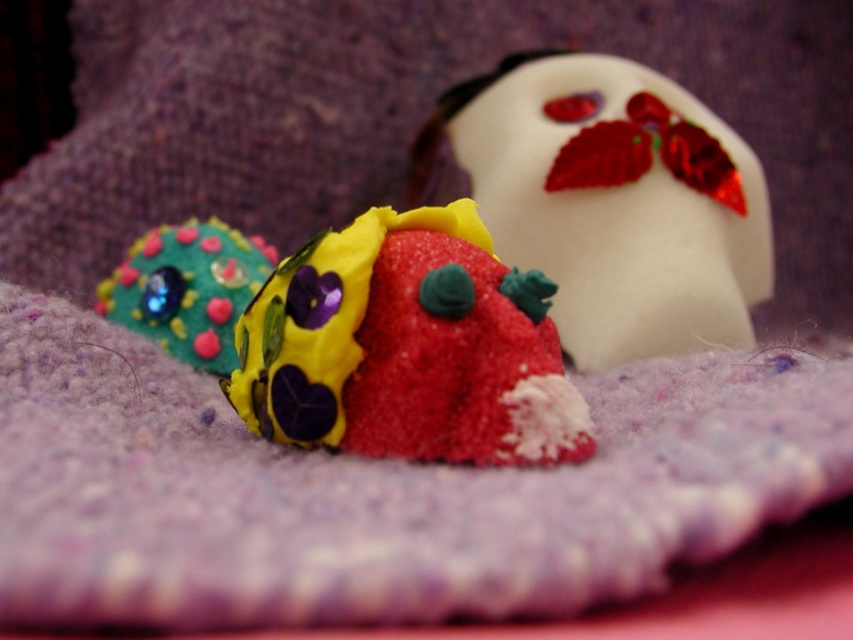
Question: Which point is closer to the camera?

Choices:
 (A) matte green fabric flower at left
 (B) white glossy ghost at upper right

Answer: (A)

Question: Is white glossy ghost at upper right closer to camera compared to matte green fabric flower at left?

Choices:
 (A) yes
 (B) no

Answer: (B)

Question: Which object is positioned farthest from the sandy clay strawberry at center?

Choices:
 (A) matte green fabric flower at left
 (B) white glossy ghost at upper right

Answer: (B)

Question: Can you confirm if sandy clay strawberry at center is bigger than matte green fabric flower at left?

Choices:
 (A) yes
 (B) no

Answer: (B)

Question: Which point appears closest to the camera in this image?

Choices:
 (A) (647, 340)
 (B) (374, 348)

Answer: (B)

Question: In this image, where is sandy clay strawberry at center located relative to matte green fabric flower at left?

Choices:
 (A) left
 (B) right

Answer: (B)